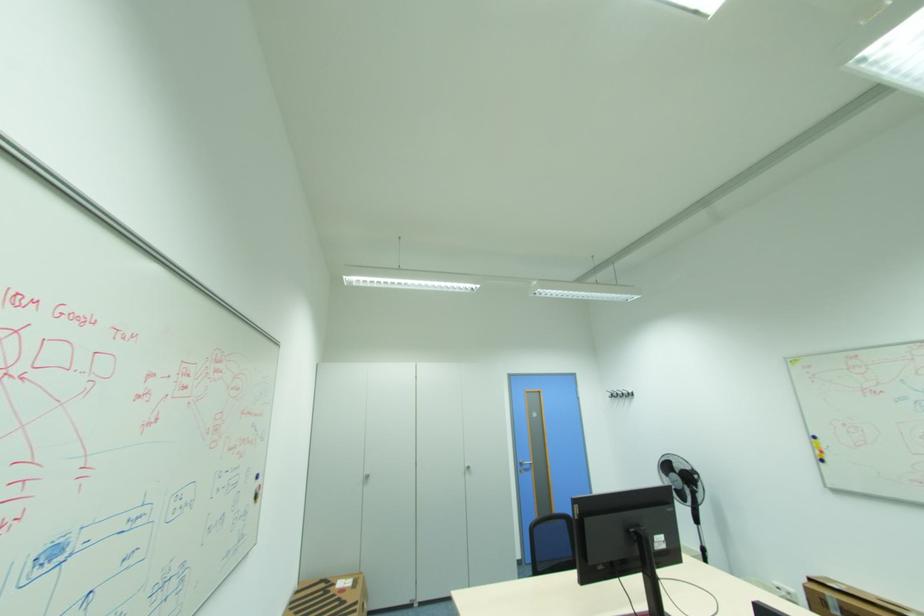
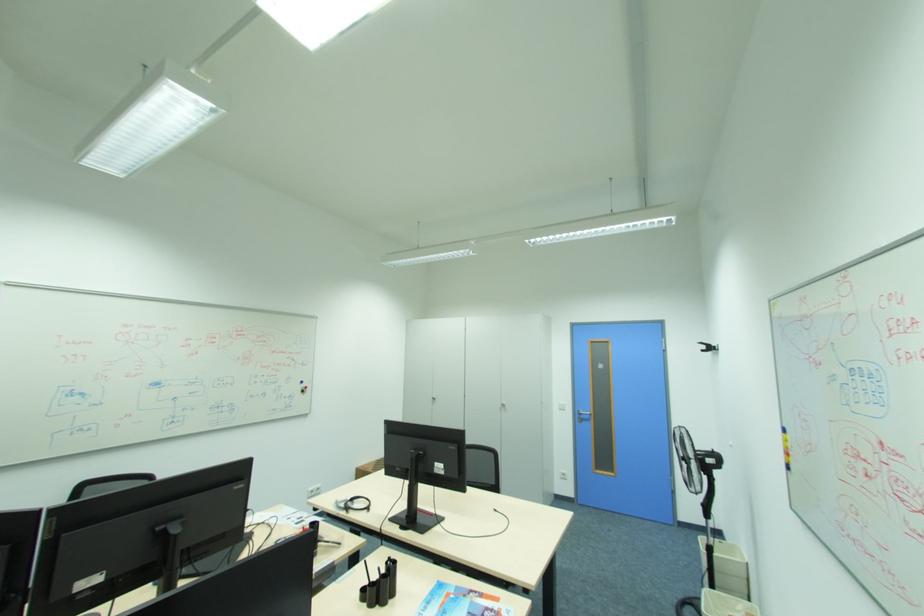
Find the pixel in the second image that matches (x=829, y=447) in the first image.

(794, 446)